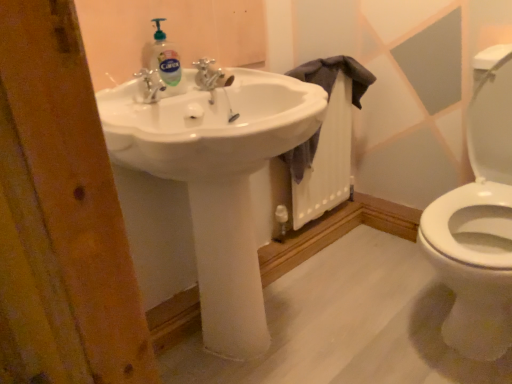
Question: Is clear liquid soap at upper center facing towards silver metallic faucet at center?

Choices:
 (A) yes
 (B) no

Answer: (B)

Question: Is clear liquid soap at upper center touching silver metallic faucet at center?

Choices:
 (A) no
 (B) yes

Answer: (B)

Question: From the image's perspective, is clear liquid soap at upper center on top of silver metallic faucet at center?

Choices:
 (A) yes
 (B) no

Answer: (B)

Question: Is silver metallic faucet at center located within clear liquid soap at upper center?

Choices:
 (A) no
 (B) yes

Answer: (A)

Question: Can you confirm if clear liquid soap at upper center is wider than silver metallic faucet at center?

Choices:
 (A) yes
 (B) no

Answer: (B)

Question: In the image, is silver metallic faucet at center on the left side or the right side of white glossy sink at center?

Choices:
 (A) right
 (B) left

Answer: (B)

Question: Based on their sizes in the image, would you say silver metallic faucet at center is bigger or smaller than white glossy sink at center?

Choices:
 (A) big
 (B) small

Answer: (B)

Question: Does point (207, 84) appear closer or farther from the camera than point (185, 173)?

Choices:
 (A) farther
 (B) closer

Answer: (A)

Question: Considering their positions, is silver metallic faucet at center located in front of or behind white glossy sink at center?

Choices:
 (A) behind
 (B) front

Answer: (A)

Question: From a real-world perspective, is clear liquid soap at upper center physically located above or below silver metallic faucet at center?

Choices:
 (A) above
 (B) below

Answer: (A)

Question: Based on their positions, is clear liquid soap at upper center located to the left or right of silver metallic faucet at center?

Choices:
 (A) left
 (B) right

Answer: (A)

Question: Looking at their shapes, would you say clear liquid soap at upper center is wider or thinner than silver metallic faucet at center?

Choices:
 (A) thin
 (B) wide

Answer: (A)

Question: From their relative heights in the image, would you say clear liquid soap at upper center is taller or shorter than silver metallic faucet at center?

Choices:
 (A) short
 (B) tall

Answer: (B)

Question: Is dark gray fabric at sink in front of or behind silver metallic faucet at center in the image?

Choices:
 (A) behind
 (B) front

Answer: (A)

Question: Is point (326, 64) closer or farther from the camera than point (209, 67)?

Choices:
 (A) closer
 (B) farther

Answer: (B)